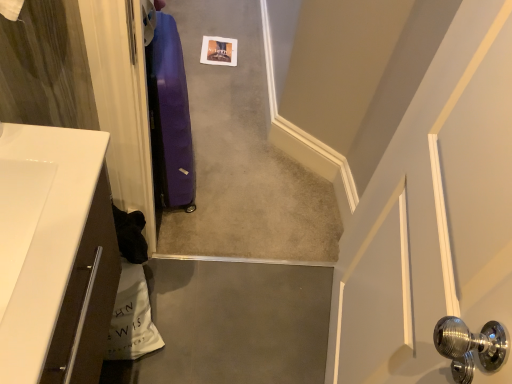
Locate an element on the screen. vacant space to the right of purple fabric suitcase at left is located at coordinates (229, 191).